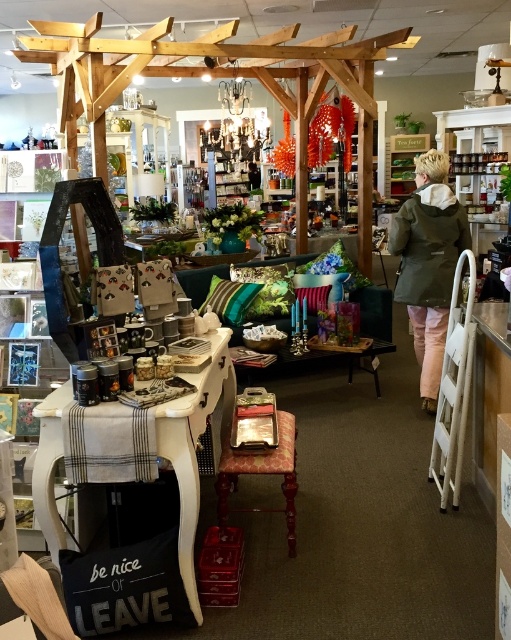
Between green matte jacket at upper right and wooden stool at center, which one is positioned lower?

wooden stool at center

Can you confirm if green matte jacket at upper right is shorter than wooden stool at center?

Incorrect, green matte jacket at upper right's height does not fall short of wooden stool at center's.

Locate an element on the screen. The height and width of the screenshot is (640, 511). green matte jacket at upper right is located at coordinates (429, 262).

The image size is (511, 640). What are the coordinates of `green matte jacket at upper right` in the screenshot? It's located at (429, 262).

Does point (421, 272) come in front of point (210, 291)?

Yes, point (421, 272) is closer to viewer.

Which is in front, point (402, 259) or point (243, 291)?

Point (402, 259) is in front.

Describe the element at coordinates (429, 262) in the screenshot. I see `green matte jacket at upper right` at that location.

Where is `green matte jacket at upper right`? The image size is (511, 640). green matte jacket at upper right is located at coordinates (429, 262).

Is wooden stool at center taller than green velvet pillow at center?

Yes, wooden stool at center is taller than green velvet pillow at center.

Based on the photo, measure the distance between point [220,524] and camera.

A distance of 7.93 feet exists between point [220,524] and camera.

Identify the location of wooden stool at center. (261, 474).